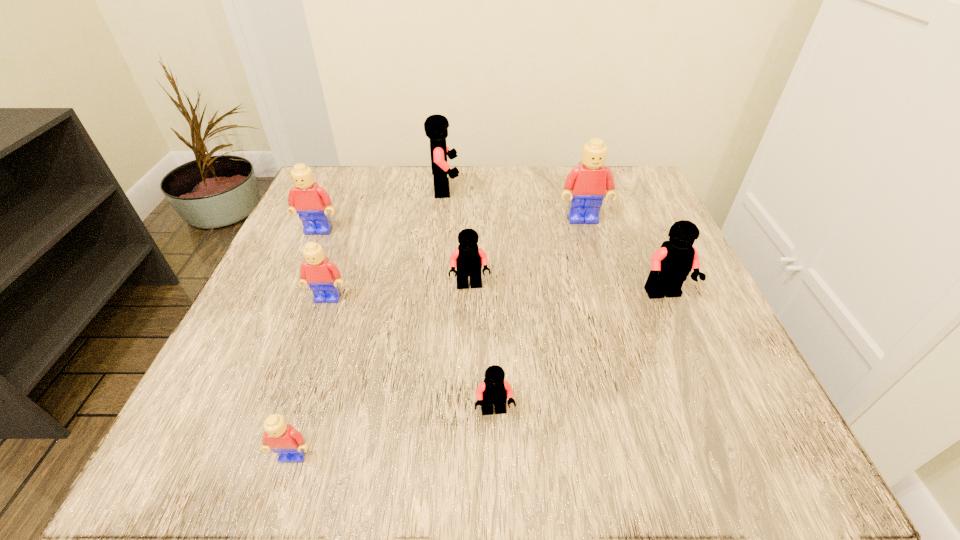
The height and width of the screenshot is (540, 960). What are the coordinates of `the smallest black Lego` in the screenshot? It's located at (494, 390).

You are a GUI agent. You are given a task and a screenshot of the screen. Output one action in this format:
    pyautogui.click(x=<x>, y=<y>)
    Task: Click on the nearest Lego
    The height and width of the screenshot is (540, 960).
    Given the screenshot: What is the action you would take?
    pyautogui.click(x=281, y=438)

You are a GUI agent. You are given a task and a screenshot of the screen. Output one action in this format:
    pyautogui.click(x=<x>, y=<y>)
    Task: Click on the smallest yellow Lego
    The height and width of the screenshot is (540, 960).
    Given the screenshot: What is the action you would take?
    pyautogui.click(x=281, y=438)

You are a GUI agent. You are given a task and a screenshot of the screen. Output one action in this format:
    pyautogui.click(x=<x>, y=<y>)
    Task: Click on the free space located on the front-facing side of the farthest object
    
    Given the screenshot: What is the action you would take?
    pyautogui.click(x=597, y=190)

Find the location of a particular element. The height and width of the screenshot is (540, 960). vacant region located on the front-facing side of the seventh Lego from left to right is located at coordinates (600, 277).

Where is `blank space located 0.160m on the front-facing side of the second biggest yellow Lego`? The width and height of the screenshot is (960, 540). blank space located 0.160m on the front-facing side of the second biggest yellow Lego is located at coordinates (292, 291).

The height and width of the screenshot is (540, 960). Find the location of `vacant region located on the front-facing side of the third smallest black Lego`. vacant region located on the front-facing side of the third smallest black Lego is located at coordinates (705, 387).

The width and height of the screenshot is (960, 540). What are the coordinates of `free space located 0.050m on the front-facing side of the third biggest black Lego` in the screenshot? It's located at (469, 316).

The height and width of the screenshot is (540, 960). Find the location of `vacant region located on the front-facing side of the second nearest yellow Lego`. vacant region located on the front-facing side of the second nearest yellow Lego is located at coordinates (299, 383).

Image resolution: width=960 pixels, height=540 pixels. Find the location of `object situated at the near left corner`. object situated at the near left corner is located at coordinates (281, 438).